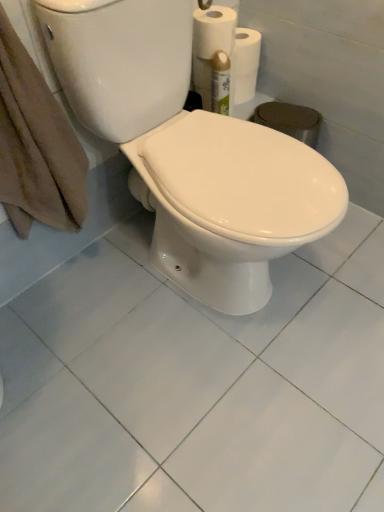
Question: Can you confirm if white glossy toilet at center is wider than white glossy ceramic tile at center?

Choices:
 (A) no
 (B) yes

Answer: (A)

Question: Is white glossy toilet at center taller than white glossy ceramic tile at center?

Choices:
 (A) no
 (B) yes

Answer: (B)

Question: Is white glossy toilet at center not within white glossy ceramic tile at center?

Choices:
 (A) yes
 (B) no

Answer: (A)

Question: Considering the relative sizes of white glossy toilet at center and white glossy ceramic tile at center in the image provided, is white glossy toilet at center bigger than white glossy ceramic tile at center?

Choices:
 (A) no
 (B) yes

Answer: (B)

Question: Is white glossy toilet at center oriented towards white glossy ceramic tile at center?

Choices:
 (A) no
 (B) yes

Answer: (A)

Question: Is white glossy toilet at center next to white glossy ceramic tile at center?

Choices:
 (A) yes
 (B) no

Answer: (B)

Question: Does white glossy toilet at center turn towards brown cotton towel at left?

Choices:
 (A) yes
 (B) no

Answer: (B)

Question: Considering the relative sizes of white glossy toilet at center and brown cotton towel at left in the image provided, is white glossy toilet at center smaller than brown cotton towel at left?

Choices:
 (A) no
 (B) yes

Answer: (A)

Question: From the image's perspective, would you say white glossy toilet at center is shown under brown cotton towel at left?

Choices:
 (A) yes
 (B) no

Answer: (A)

Question: Does white glossy toilet at center lie behind brown cotton towel at left?

Choices:
 (A) yes
 (B) no

Answer: (B)

Question: Is white glossy toilet at center to the left of brown cotton towel at left from the viewer's perspective?

Choices:
 (A) yes
 (B) no

Answer: (B)

Question: Does white glossy toilet at center have a lesser width compared to brown cotton towel at left?

Choices:
 (A) yes
 (B) no

Answer: (B)

Question: Is brown cotton towel at left wider than white glossy toilet at center?

Choices:
 (A) no
 (B) yes

Answer: (A)